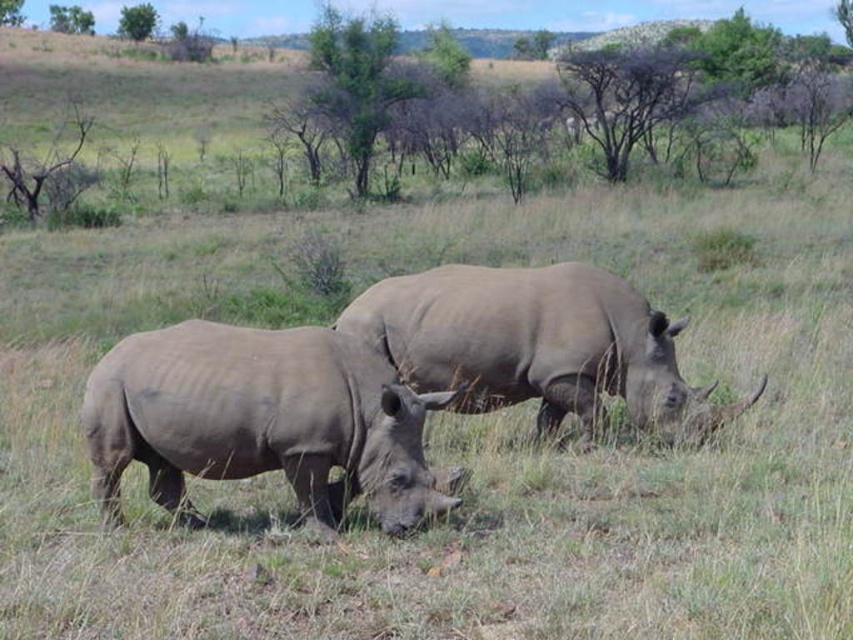
You are a wildlife photographer positioned at the center of the savanna. You want to capture a photo of the gray matte rhinoceros at lower left. Based on its position, which direction should you move to get closer to it?

The gray matte rhinoceros at lower left is located at point (x=260, y=420), so you should move to the left and slightly forward to get closer to it.